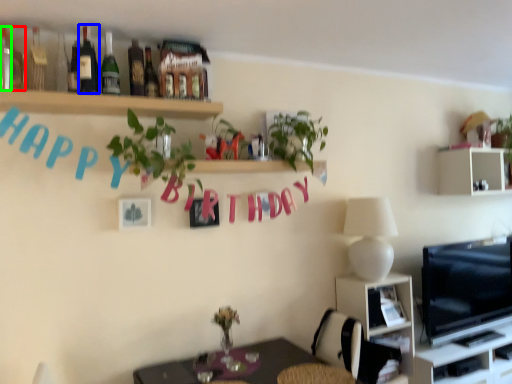
Question: Considering the real-world distances, which object is closest to bottle (highlighted by a red box)? bottle (highlighted by a blue box) or bottle (highlighted by a green box).

Choices:
 (A) bottle
 (B) bottle

Answer: (B)